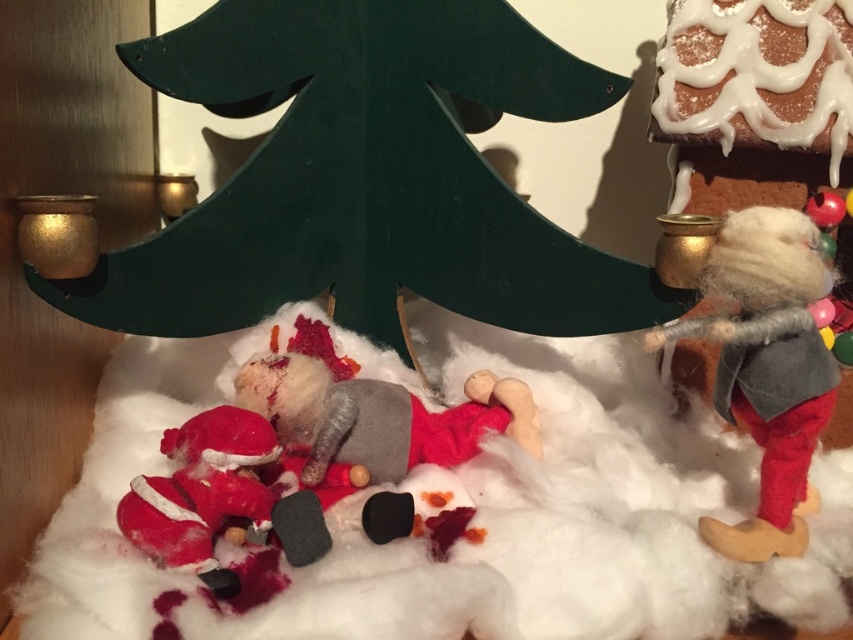
Consider the image. In the festive Christmas scene, there is a fuzzy woolen elf at right and a fuzzy red santa at lower left. If you have a gift box that is 15 inches long, can you place it between them without moving either figure?

The distance between the fuzzy woolen elf at right and the fuzzy red santa at lower left is 16.34 inches. Since the gift box is 15 inches long, it can fit between them as the space is wider than the box.

In the festive Christmas scene, there are two figures made of fuzzy materials. The fuzzy woolen elf at right and the fuzzy red santa at lower left. Which of these two figures is taller?

The fuzzy woolen elf at right is taller than the fuzzy red santa at lower left.